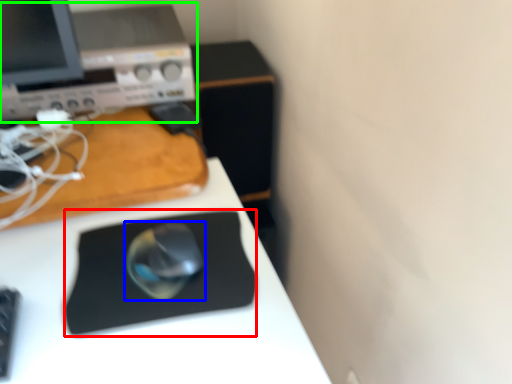
Question: Based on their relative distances, which object is farther from mousepad (highlighted by a red box)? Choose from mouse (highlighted by a blue box) and desktop computer (highlighted by a green box).

Choices:
 (A) mouse
 (B) desktop computer

Answer: (B)